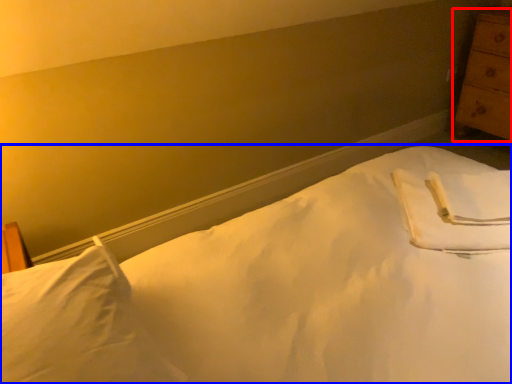
Question: Which of the following is the farthest to the observer, chest of drawers (highlighted by a red box) or bed (highlighted by a blue box)?

Choices:
 (A) chest of drawers
 (B) bed

Answer: (A)